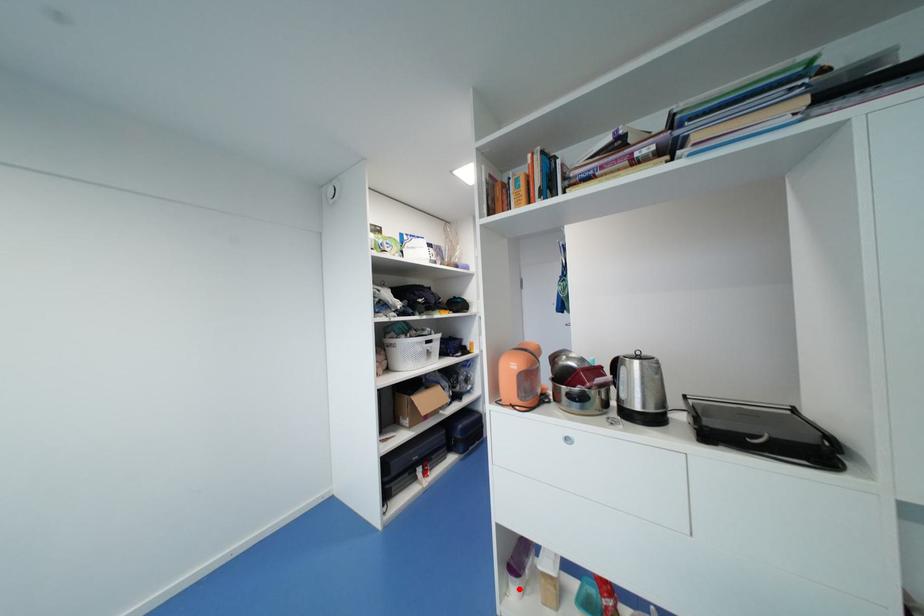
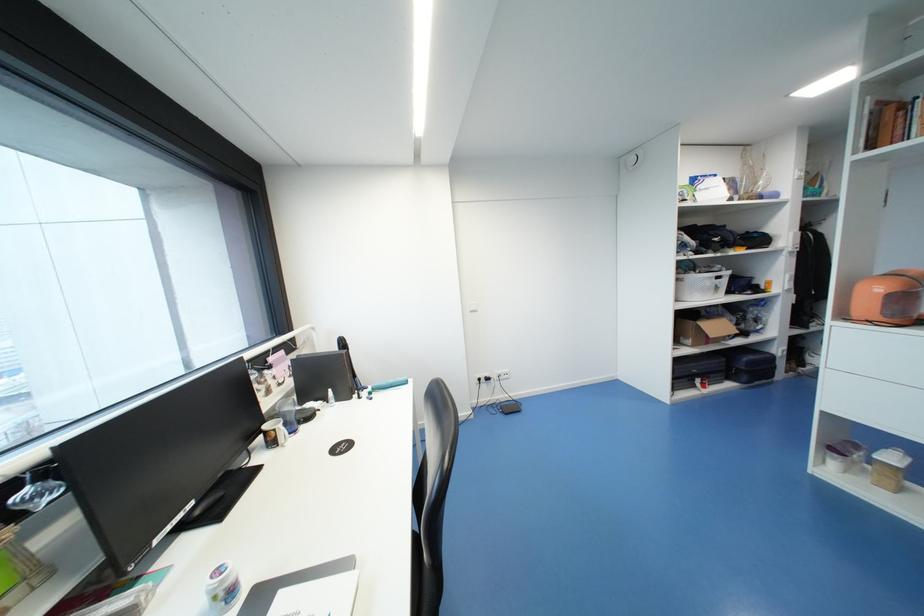
Where in the second image is the point corresponding to the highlighted location from the first image?

(839, 464)